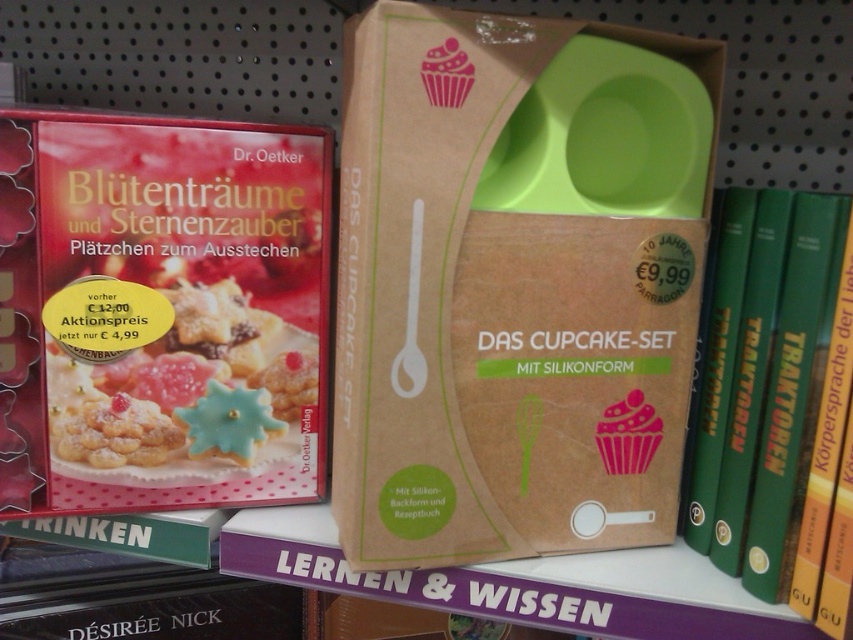
Can you confirm if matte brown cardboard box at center is wider than matte red book at left?

Indeed, matte brown cardboard box at center has a greater width compared to matte red book at left.

The image size is (853, 640). What do you see at coordinates (509, 291) in the screenshot?
I see `matte brown cardboard box at center` at bounding box center [509, 291].

Which is behind, point (514, 420) or point (184, 189)?

Point (184, 189)

Where is `matte brown cardboard box at center`? This screenshot has height=640, width=853. matte brown cardboard box at center is located at coordinates (509, 291).

The image size is (853, 640). Describe the element at coordinates (761, 380) in the screenshot. I see `green matte book at right` at that location.

Is point (695, 464) positioned in front of point (120, 372)?

No.

Where is `green matte book at right`? green matte book at right is located at coordinates (761, 380).

Who is more forward, (119, 179) or (132, 435)?

Point (119, 179) is in front.

Is point (280, 196) positioned behind point (80, 371)?

Yes, point (280, 196) is behind point (80, 371).

This screenshot has width=853, height=640. I want to click on matte red book at left, so click(160, 312).